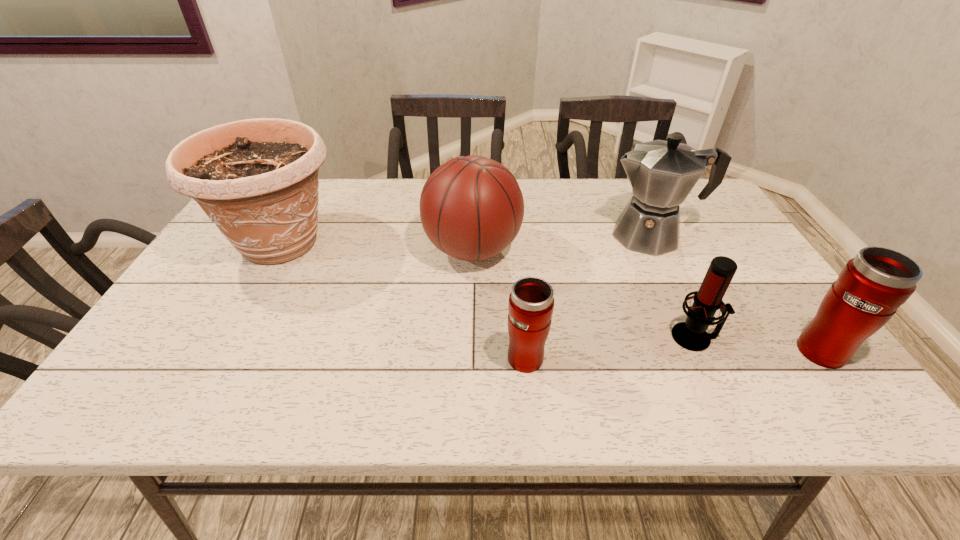
Find the location of `vacant space located on the side with the handle of the right thermos bottle`. vacant space located on the side with the handle of the right thermos bottle is located at coordinates (756, 258).

The width and height of the screenshot is (960, 540). Find the location of `vacant space located 0.130m on the side with the handle of the right thermos bottle`. vacant space located 0.130m on the side with the handle of the right thermos bottle is located at coordinates 778,288.

Identify the location of free spot located 0.290m on the side with the handle of the right thermos bottle. pyautogui.click(x=749, y=248).

Locate an element on the screen. The width and height of the screenshot is (960, 540). free spot located 0.400m at the spout of the coffeepot is located at coordinates (464, 235).

This screenshot has width=960, height=540. I want to click on vacant position located 0.200m at the spout of the coffeepot, so click(x=534, y=235).

This screenshot has height=540, width=960. In order to click on vacant region located at the spout of the coffeepot in this screenshot , I will do `click(537, 235)`.

This screenshot has width=960, height=540. Identify the location of vacant region located on the left of the basketball. (391, 249).

Image resolution: width=960 pixels, height=540 pixels. I want to click on free space located 0.350m on the right of the leftmost object, so click(x=469, y=242).

The width and height of the screenshot is (960, 540). I want to click on free location located 0.240m on the back of the microphone, so (657, 256).

I want to click on coffeepot that is at the far edge, so click(662, 173).